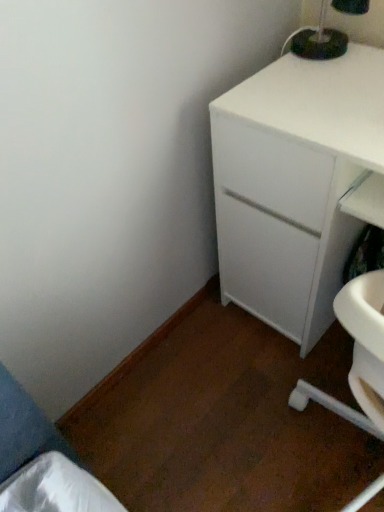
Question: Considering the relative sizes of white matte cabinet at upper right and black plastic lamp at upper right in the image provided, is white matte cabinet at upper right thinner than black plastic lamp at upper right?

Choices:
 (A) yes
 (B) no

Answer: (B)

Question: Can you confirm if white matte cabinet at upper right is shorter than black plastic lamp at upper right?

Choices:
 (A) yes
 (B) no

Answer: (B)

Question: Are white matte cabinet at upper right and black plastic lamp at upper right making contact?

Choices:
 (A) yes
 (B) no

Answer: (B)

Question: Would you say white matte cabinet at upper right is outside black plastic lamp at upper right?

Choices:
 (A) yes
 (B) no

Answer: (A)

Question: From a real-world perspective, is white matte cabinet at upper right located beneath black plastic lamp at upper right?

Choices:
 (A) no
 (B) yes

Answer: (B)

Question: Is white matte cabinet at upper right at the right side of black plastic lamp at upper right?

Choices:
 (A) no
 (B) yes

Answer: (B)

Question: Considering the relative sizes of black plastic lamp at upper right and white matte cabinet at upper right in the image provided, is black plastic lamp at upper right shorter than white matte cabinet at upper right?

Choices:
 (A) no
 (B) yes

Answer: (B)

Question: Is black plastic lamp at upper right not inside white matte cabinet at upper right?

Choices:
 (A) no
 (B) yes

Answer: (B)

Question: Does black plastic lamp at upper right have a smaller size compared to white matte cabinet at upper right?

Choices:
 (A) yes
 (B) no

Answer: (A)

Question: Would you consider black plastic lamp at upper right to be distant from white matte cabinet at upper right?

Choices:
 (A) no
 (B) yes

Answer: (A)

Question: Is black plastic lamp at upper right to the right of white matte cabinet at upper right from the viewer's perspective?

Choices:
 (A) yes
 (B) no

Answer: (B)

Question: Can you confirm if black plastic lamp at upper right is wider than white matte cabinet at upper right?

Choices:
 (A) yes
 (B) no

Answer: (B)

Question: Considering the positions of point (355, 167) and point (342, 33), is point (355, 167) closer or farther from the camera than point (342, 33)?

Choices:
 (A) closer
 (B) farther

Answer: (A)